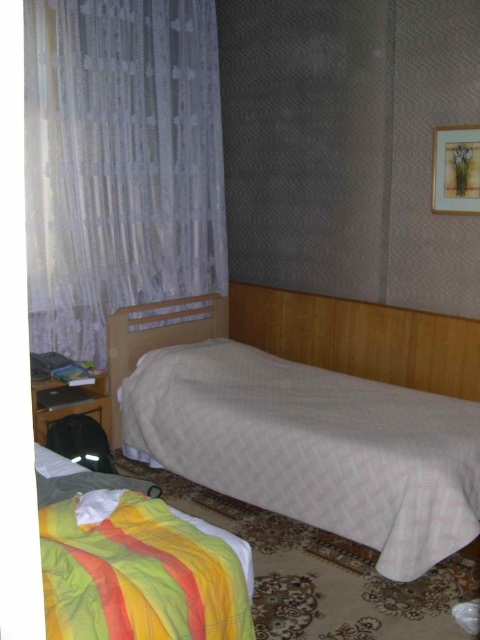
You are a delivery person trying to place a package on the floor between the white sheer curtain at left and the striped cotton blanket at lower left. The package is 3 feet long. Is there enough space between them to place the package horizontally?

The distance between the white sheer curtain at left and the striped cotton blanket at lower left is 7.23 feet. Since the package is 3 feet long, there is sufficient space to place it horizontally between them.

You are standing in the bedroom and want to hang a new picture frame on the wall between the white woven bed at center and the white sheer curtain at left. Based on their positions, where should you place the frame?

The white woven bed at center is below the white sheer curtain at left, so you should place the frame between them either above the bed but below the curtain or adjust according to the vertical alignment.